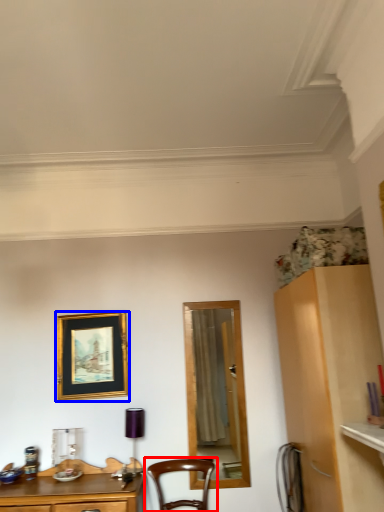
Question: Which object appears farthest to the camera in this image, chair (highlighted by a red box) or picture frame (highlighted by a blue box)?

Choices:
 (A) chair
 (B) picture frame

Answer: (B)